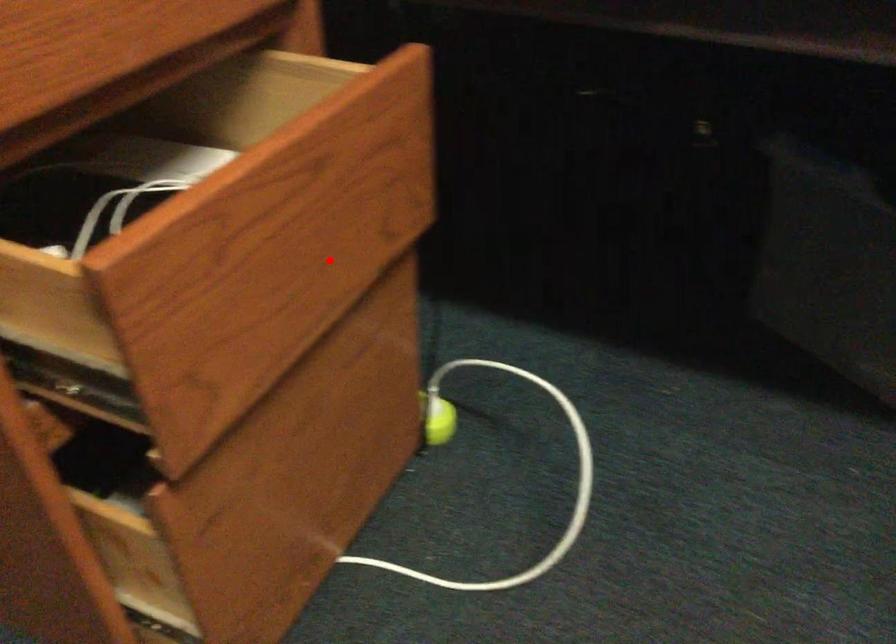
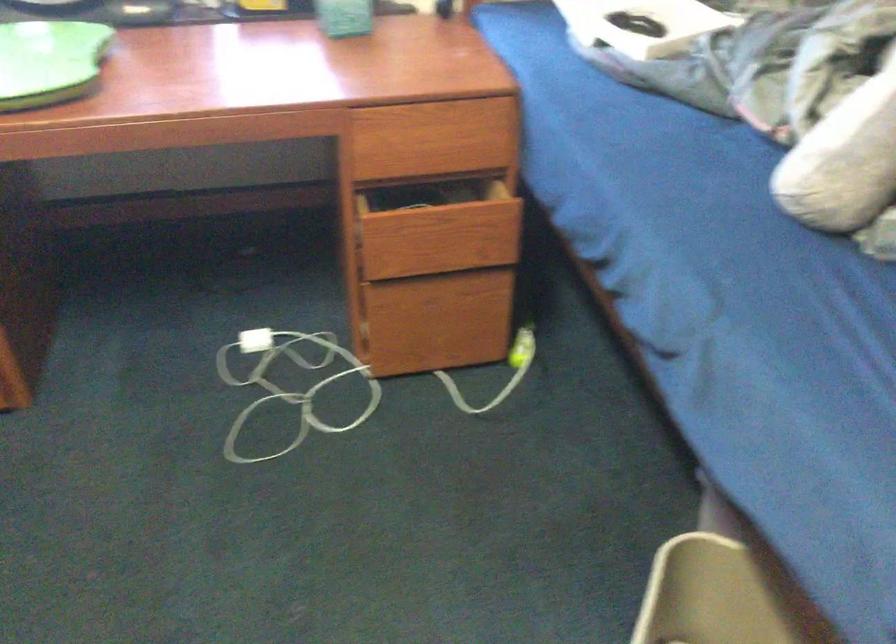
Locate, in the second image, the point that corresponds to the highlighted location in the first image.

(458, 242)